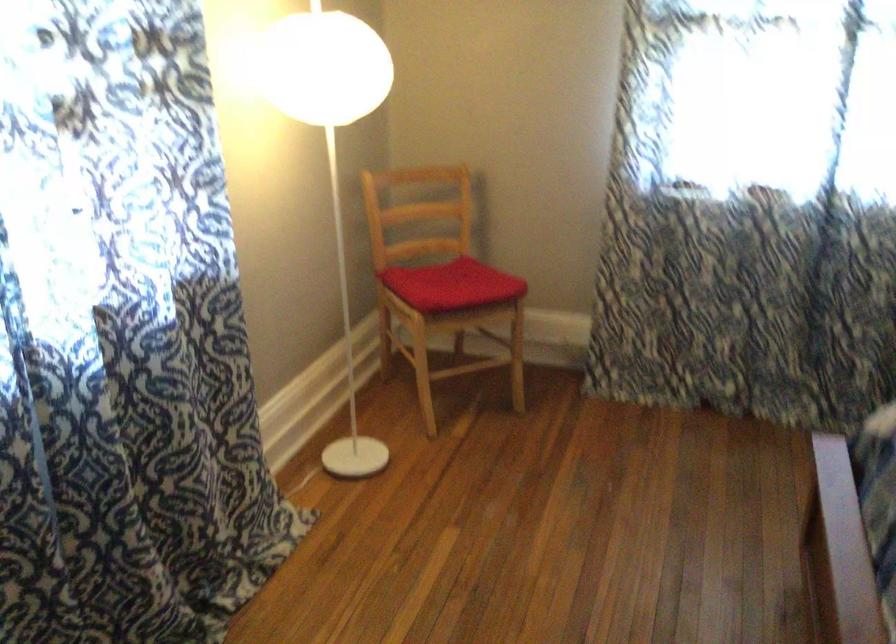
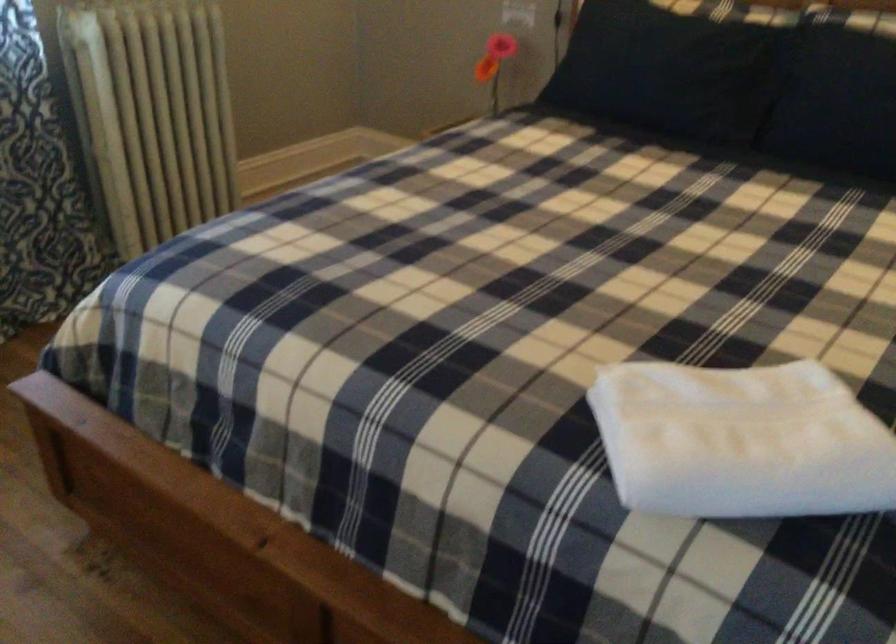
Based on the continuous images, in which direction is the camera rotating?

The rotation direction of the camera is right-down.